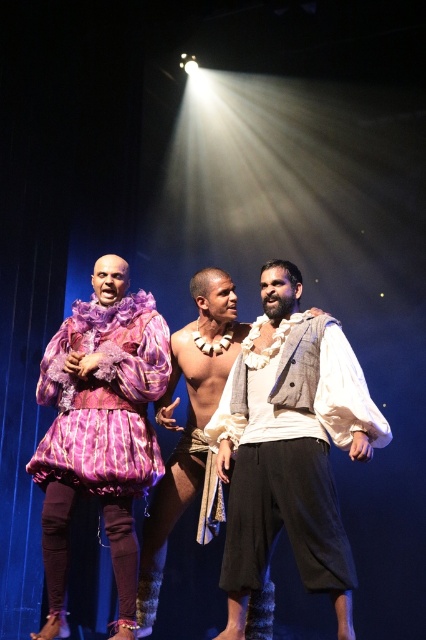
Question: Among these points, which one is farthest from the camera?

Choices:
 (A) (144, 316)
 (B) (307, 561)
 (C) (152, 508)

Answer: (A)

Question: Does matte purple fabric dress at left have a larger size compared to white textured scarf at center?

Choices:
 (A) no
 (B) yes

Answer: (A)

Question: Does matte purple fabric dress at left appear on the right side of white textured scarf at center?

Choices:
 (A) yes
 (B) no

Answer: (B)

Question: Is white cotton shirt at center to the right of matte purple fabric dress at left from the viewer's perspective?

Choices:
 (A) yes
 (B) no

Answer: (A)

Question: Which of these objects is positioned farthest from the matte purple fabric dress at left?

Choices:
 (A) white textured scarf at center
 (B) white cotton shirt at center

Answer: (B)

Question: Which object is positioned farthest from the matte purple fabric dress at left?

Choices:
 (A) white cotton shirt at center
 (B) white textured scarf at center

Answer: (A)